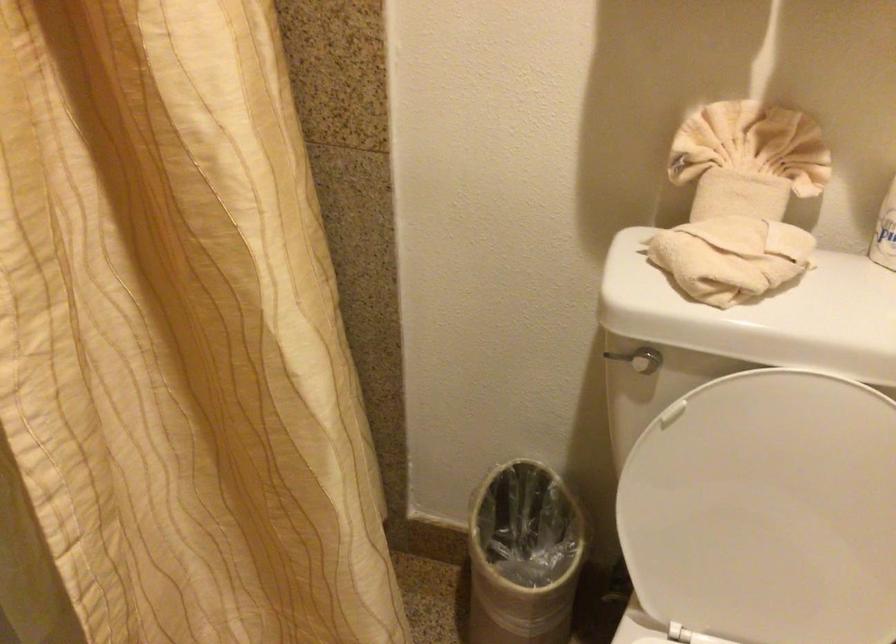
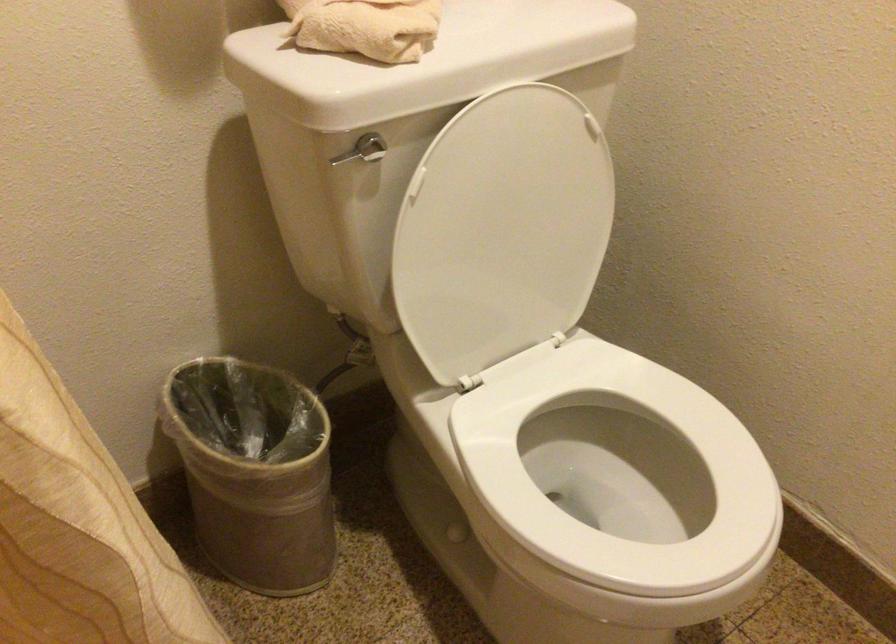
Find the pixel in the second image that matches pixel 623 357 in the first image.

(348, 155)